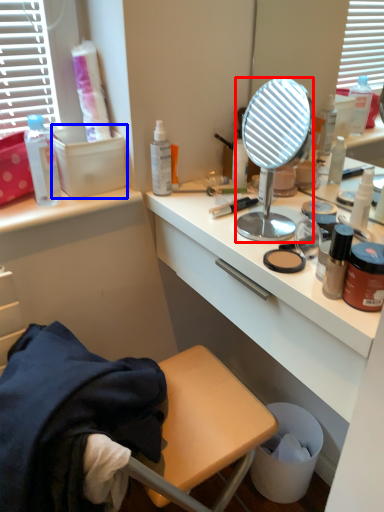
Question: Which object is further to the camera taking this photo, mirror (highlighted by a red box) or box (highlighted by a blue box)?

Choices:
 (A) mirror
 (B) box

Answer: (B)